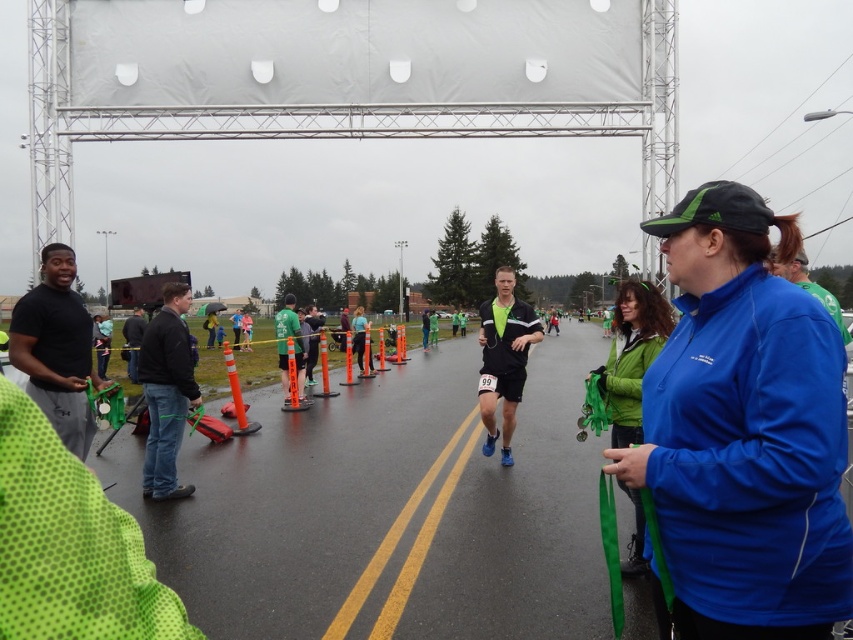
Question: Is blue fleece jacket at right wider than green fleece jacket at right?

Choices:
 (A) no
 (B) yes

Answer: (A)

Question: Is blue fleece jacket at right to the right of green fleece jacket at right from the viewer's perspective?

Choices:
 (A) no
 (B) yes

Answer: (A)

Question: Among these points, which one is farthest from the camera?

Choices:
 (A) (633, 337)
 (B) (729, 566)

Answer: (A)

Question: Does blue fleece jacket at right appear under green fleece jacket at right?

Choices:
 (A) yes
 (B) no

Answer: (B)

Question: Which object appears closest to the camera in this image?

Choices:
 (A) blue fleece jacket at right
 (B) green fleece jacket at right

Answer: (A)